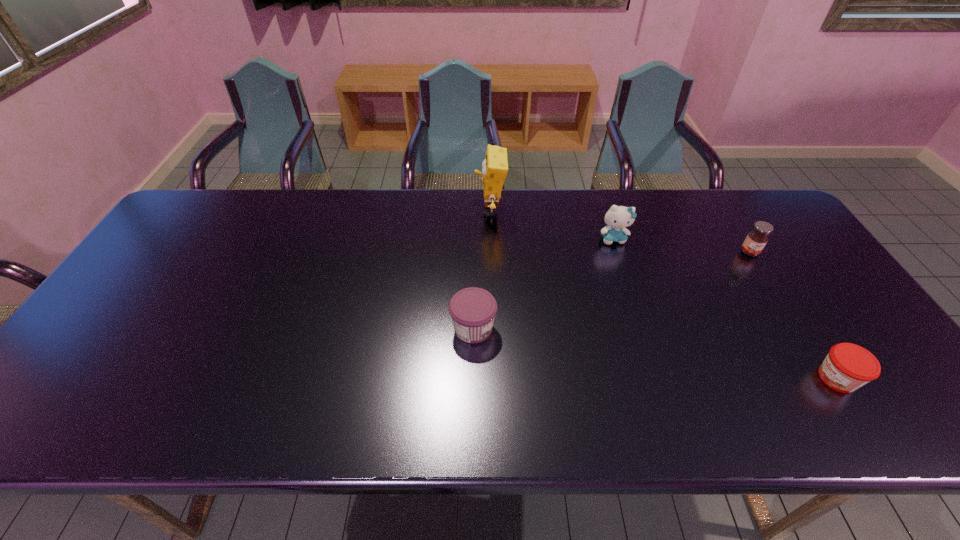
Identify the location of vacant space in between the second farthest jam and the fourth shortest object. (543, 284).

Where is `free space that is in between the kitten and the second nearest object`? free space that is in between the kitten and the second nearest object is located at coordinates (543, 284).

The image size is (960, 540). Find the location of `vacant point located between the second nearest object and the farthest jam`. vacant point located between the second nearest object and the farthest jam is located at coordinates (612, 291).

Locate an element on the screen. empty location between the kitten and the farthest jam is located at coordinates (682, 245).

Locate an element on the screen. The image size is (960, 540). free spot between the kitten and the second nearest jam is located at coordinates (543, 284).

Find the location of a particular element. The image size is (960, 540). object that is the closest to the farthest jam is located at coordinates (617, 218).

Locate which object is the closest to the sponge. Please provide its 2D coordinates. Your answer should be formatted as a tuple, i.e. [(x, y)], where the tuple contains the x and y coordinates of a point satisfying the conditions above.

[(617, 218)]

Locate which jam is the closest to the farthest jam. Please provide its 2D coordinates. Your answer should be formatted as a tuple, i.e. [(x, y)], where the tuple contains the x and y coordinates of a point satisfying the conditions above.

[(847, 367)]

The image size is (960, 540). Identify the location of jam that stands as the closest to the farthest jam. (847, 367).

Locate an element on the screen. This screenshot has height=540, width=960. free location that satisfies the following two spatial constraints: 1. on the label side of the farthest jam; 2. on the front label of the second nearest object is located at coordinates (797, 328).